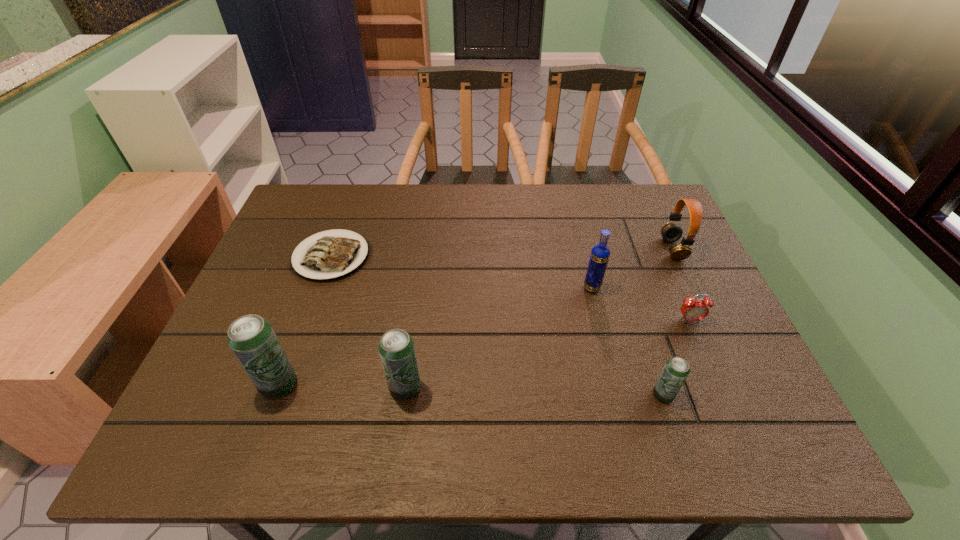
Identify the location of vacant point located on the right of the leftmost beer can. The height and width of the screenshot is (540, 960). (386, 384).

Find the location of a particular element. free spot located on the right of the second beer can from left to right is located at coordinates (571, 388).

I want to click on vacant region located on the left of the fifth object from left to right, so click(600, 395).

Locate an element on the screen. free space located on the ear cups of the headset is located at coordinates (529, 249).

Where is `vacant space located on the ear cups of the headset`? The height and width of the screenshot is (540, 960). vacant space located on the ear cups of the headset is located at coordinates (596, 249).

I want to click on vacant space located 0.080m on the ear cups of the headset, so click(x=635, y=249).

Find the location of a particular element. The image size is (960, 540). vacant area situated 0.060m on the back of the fourth object from left to right is located at coordinates (587, 266).

The width and height of the screenshot is (960, 540). I want to click on vacant space located 0.180m on the face of the second shortest object, so click(x=720, y=392).

I want to click on vacant space located on the left of the plate, so pos(271,256).

At what (x,y) coordinates should I click in order to perform the action: click on object that is at the far edge. Please return your answer as a coordinate pair (x, y). Looking at the image, I should click on point(332,256).